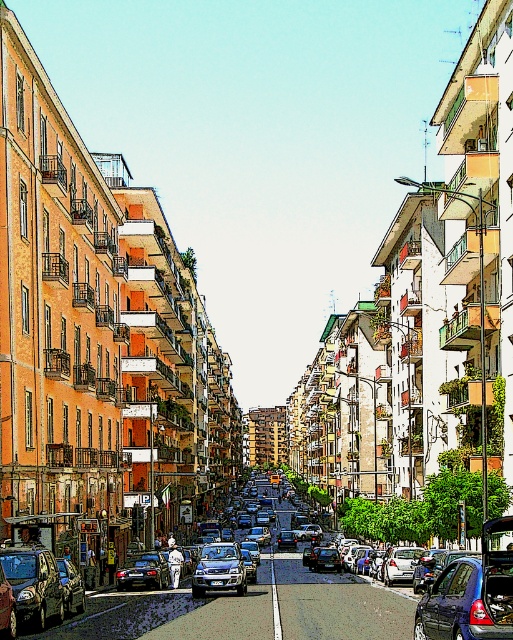
Question: Which point is closer to the camera taking this photo?

Choices:
 (A) (214, 580)
 (B) (503, 592)

Answer: (B)

Question: Among these objects, which one is nearest to the camera?

Choices:
 (A) shiny black sedan at center
 (B) metallic silver sedan at center
 (C) metallic silver car at center
 (D) metallic silver car at center-left

Answer: (D)

Question: Which object is closer to the camera taking this photo?

Choices:
 (A) metallic blue hatchback at center
 (B) metallic silver sedan at center
 (C) metallic silver car at center-left

Answer: (A)

Question: Does metallic silver car at center-left appear over metallic silver sedan at center?

Choices:
 (A) yes
 (B) no

Answer: (A)

Question: Does metallic blue hatchback at center have a larger size compared to metallic silver sedan at center?

Choices:
 (A) no
 (B) yes

Answer: (B)

Question: Observing the image, what is the correct spatial positioning of metallic silver car at center-left in reference to black plastic license plate at center?

Choices:
 (A) left
 (B) right

Answer: (A)